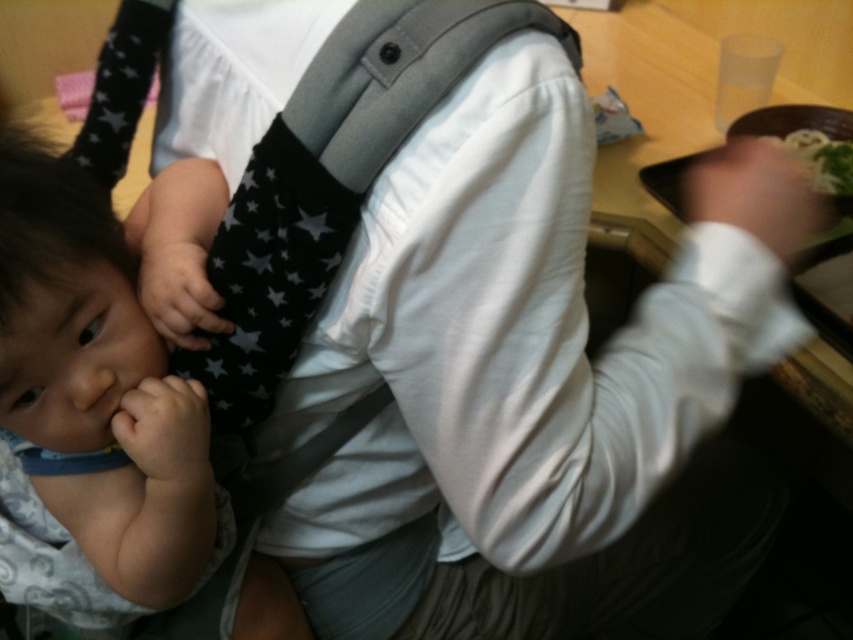
Which of these two, soft white baby at center or white noodles at upper right, stands shorter?

Standing shorter between the two is white noodles at upper right.

This screenshot has height=640, width=853. Identify the location of soft white baby at center. (90, 408).

Between point (68, 600) and point (840, 192), which one is positioned behind?

Positioned behind is point (840, 192).

This screenshot has height=640, width=853. What are the coordinates of `soft white baby at center` in the screenshot? It's located at click(90, 408).

Does black star-patterned carrier at center have a larger size compared to white noodles at upper right?

Yes.

In the scene shown: Which is below, black star-patterned carrier at center or white noodles at upper right?

Positioned lower is black star-patterned carrier at center.

Is point (312, 216) positioned after point (825, 166)?

That is False.

Image resolution: width=853 pixels, height=640 pixels. I want to click on black star-patterned carrier at center, so click(331, 177).

Is point (131, 528) more distant than point (335, 268)?

Yes, point (131, 528) is farther from viewer.

Between soft white baby at center and black star-patterned carrier at center, which one is positioned higher?

black star-patterned carrier at center is above.

What do you see at coordinates (90, 408) in the screenshot?
I see `soft white baby at center` at bounding box center [90, 408].

Find the location of a particular element. Image resolution: width=853 pixels, height=640 pixels. soft white baby at center is located at coordinates (90, 408).